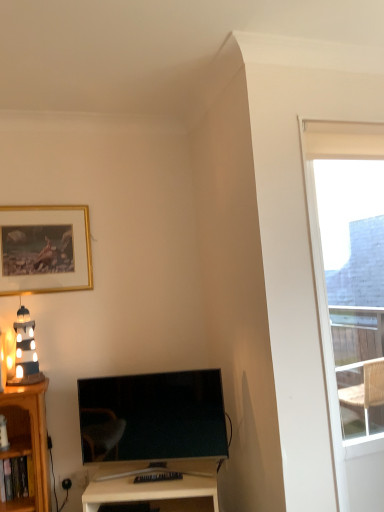
Question: In the image, is white glossy desk at center on the left side or the right side of matte black lighthouse at left?

Choices:
 (A) right
 (B) left

Answer: (A)

Question: Does point (153, 497) appear closer or farther from the camera than point (11, 377)?

Choices:
 (A) farther
 (B) closer

Answer: (B)

Question: Estimate the real-world distances between objects in this image. Which object is closer to the matte black tv at lower center?

Choices:
 (A) gold-framed picture at upper left
 (B) white glossy desk at center
 (C) transparent glass window at upper right
 (D) matte black lighthouse at left

Answer: (B)

Question: Which is nearer to the matte black lighthouse at left?

Choices:
 (A) matte black tv at lower center
 (B) white glossy desk at center
 (C) gold-framed picture at upper left
 (D) transparent glass window at upper right

Answer: (C)